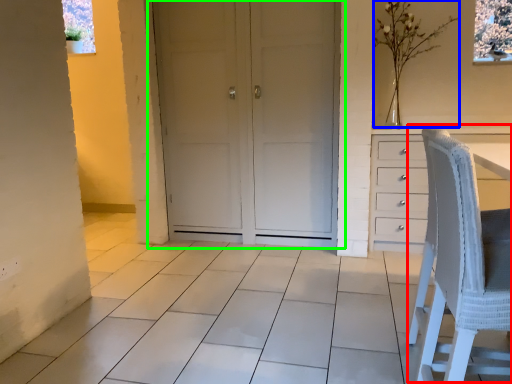
Question: Based on their relative distances, which object is farther from rocking chair (highlighted by a red box)? Choose from flower (highlighted by a blue box) and door (highlighted by a green box).

Choices:
 (A) flower
 (B) door

Answer: (A)